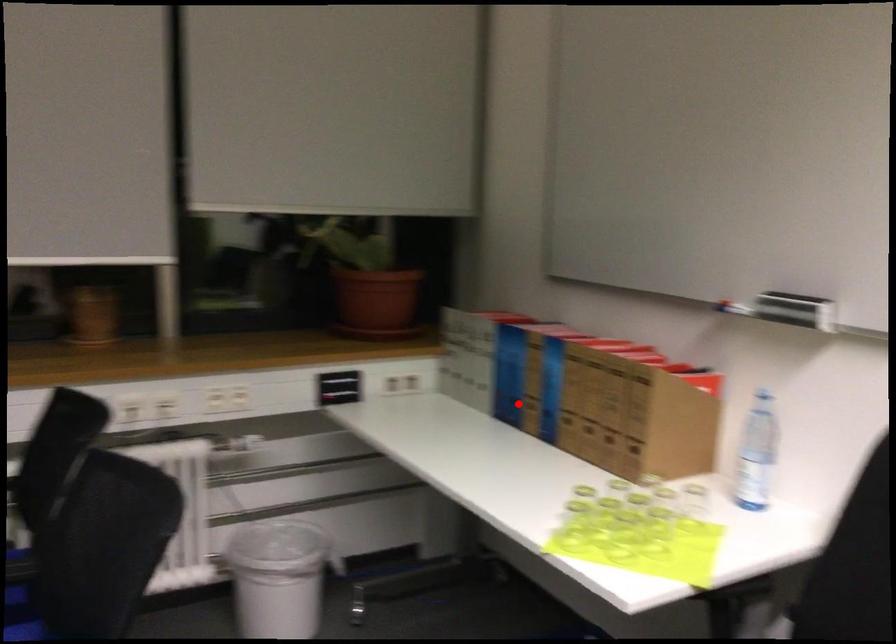
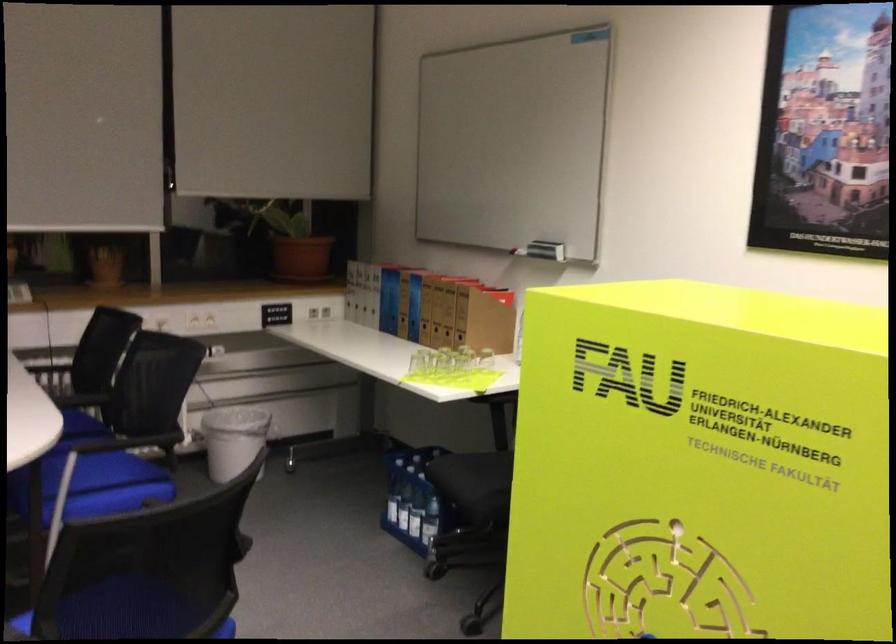
In the second image, find the point that corresponds to the highlighted location in the first image.

(398, 317)